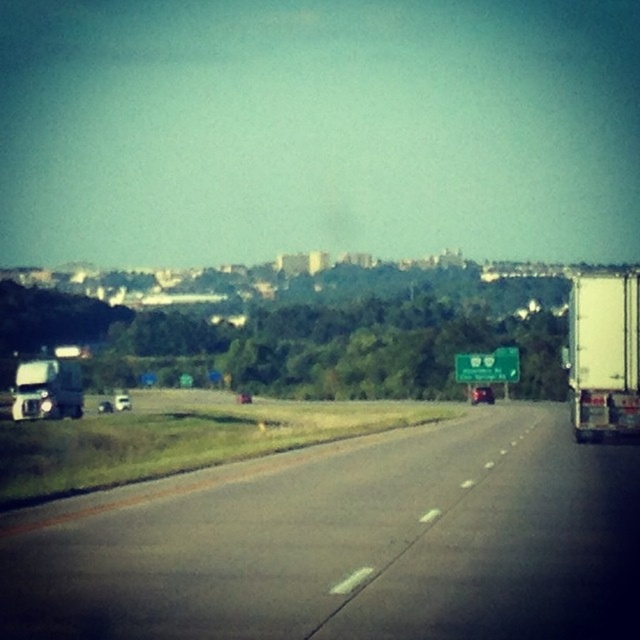
You are standing at the point labeled as point (x=348, y=544) in the image. What surface are you currently standing on?

The point (x=348, y=544) corresponds to the black asphalt highway at center, so you are standing on the black asphalt highway at center.

You are standing at the point labeled as point (348, 544) in the image. What is the color of the surface you are currently standing on?

The point (348, 544) indicates black asphalt highway at center, so the surface is black asphalt.

Looking at this image, you are a delivery driver who needs to determine which vehicle is taller to decide which one can pass under a low bridge ahead. You see the white matte trailer truck at right and the white matte truck at left. Which vehicle is taller?

The white matte trailer truck at right is taller than the white matte truck at left, so it cannot pass under the low bridge if the white matte truck at left can.